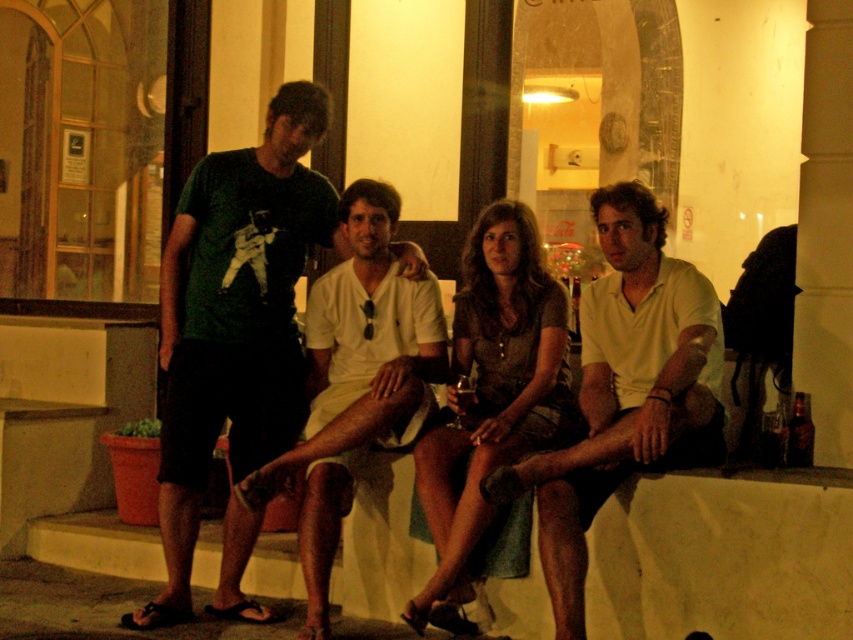
Which is in front, point (177, 269) or point (706, 296)?

Point (706, 296) is in front.

Does green matte t-shirt at center have a greater height compared to white cotton shirt at center?

Correct, green matte t-shirt at center is much taller as white cotton shirt at center.

Does point (196, 260) come behind point (489, 493)?

Yes, point (196, 260) is behind point (489, 493).

This screenshot has width=853, height=640. I want to click on green matte t-shirt at center, so click(235, 320).

Does green matte t-shirt at center appear on the right side of matte brown dress at center?

Incorrect, green matte t-shirt at center is not on the right side of matte brown dress at center.

Is green matte t-shirt at center shorter than matte brown dress at center?

In fact, green matte t-shirt at center may be taller than matte brown dress at center.

Measure the distance between point [322,221] and camera.

23.15 feet

Where is `green matte t-shirt at center`? The image size is (853, 640). green matte t-shirt at center is located at coordinates (235, 320).

Is point (625, 404) behind point (328, 291)?

That is False.

Is white cotton shirt at center wider than white cotton shorts at center?

Correct, the width of white cotton shirt at center exceeds that of white cotton shorts at center.

This screenshot has width=853, height=640. In order to click on white cotton shirt at center in this screenshot , I will do `click(624, 390)`.